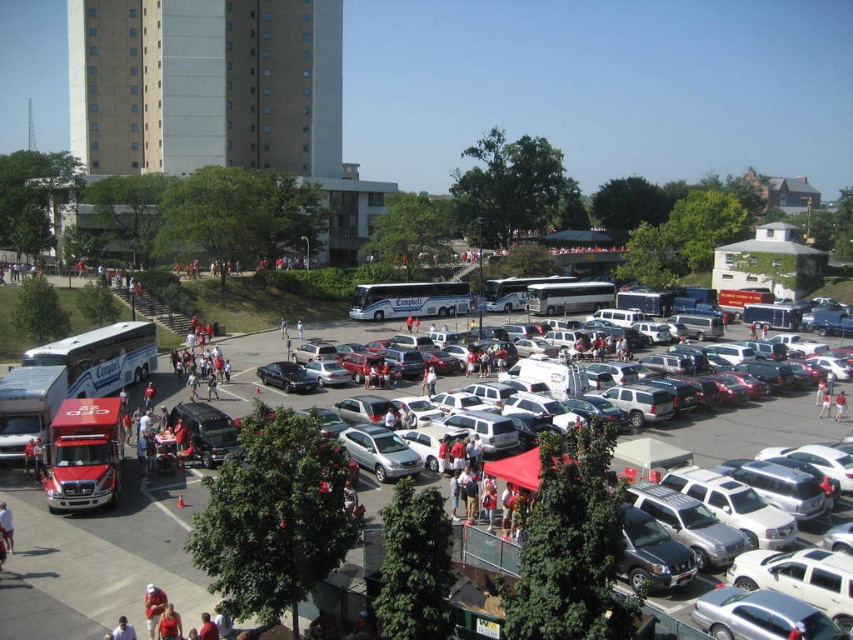
Is white matte bus at upper left positioned in front of blue metallic bus at center?

Yes, it is in front of blue metallic bus at center.

Is white matte bus at upper left to the left of blue metallic bus at center from the viewer's perspective?

Yes, white matte bus at upper left is to the left of blue metallic bus at center.

At what (x,y) coordinates should I click in order to perform the action: click on white matte bus at upper left. Please return your answer as a coordinate pair (x, y). The width and height of the screenshot is (853, 640). Looking at the image, I should click on (77, 600).

Can you confirm if white metallic bus at left is positioned to the right of blue metallic bus at center?

No, white metallic bus at left is not to the right of blue metallic bus at center.

Does point (123, 339) lie behind point (523, 296)?

No, (123, 339) is in front of (523, 296).

Does point (39, 346) come behind point (497, 305)?

That is False.

Identify the location of white metallic bus at left. The width and height of the screenshot is (853, 640). (102, 356).

Which is more to the right, red matte truck at left or blue metallic bus at center?

blue metallic bus at center is more to the right.

Can you confirm if red matte truck at left is taller than blue metallic bus at center?

Indeed, red matte truck at left has a greater height compared to blue metallic bus at center.

This screenshot has height=640, width=853. Find the location of `red matte truck at left`. red matte truck at left is located at coordinates (70, 378).

At what (x,y) coordinates should I click in order to perform the action: click on red matte truck at left. Please return your answer as a coordinate pair (x, y). The height and width of the screenshot is (640, 853). Looking at the image, I should click on (70, 378).